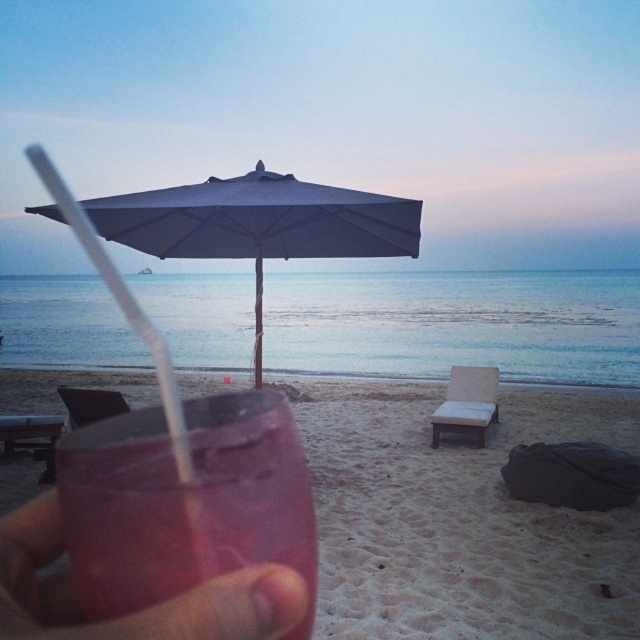
The width and height of the screenshot is (640, 640). What do you see at coordinates (259, 224) in the screenshot? I see `gray fabric umbrella at center` at bounding box center [259, 224].

From the picture: Can you confirm if gray fabric umbrella at center is taller than pink matte cup at lower left?

Indeed, gray fabric umbrella at center has a greater height compared to pink matte cup at lower left.

Identify the location of gray fabric umbrella at center. (259, 224).

Based on the photo, can you confirm if sandy beige at lower center is positioned below pink matte cup at lower left?

Yes.

Does sandy beige at lower center have a greater width compared to pink matte cup at lower left?

Correct, the width of sandy beige at lower center exceeds that of pink matte cup at lower left.

Which is behind, point (454, 545) or point (10, 612)?

The point (454, 545) is behind.

Identify the location of sandy beige at lower center. pyautogui.click(x=461, y=516).

Does gray fabric umbrella at center have a greater height compared to transparent plastic straw at lower left?

No, gray fabric umbrella at center is not taller than transparent plastic straw at lower left.

At what (x,y) coordinates should I click in order to perform the action: click on gray fabric umbrella at center. Please return your answer as a coordinate pair (x, y). Looking at the image, I should click on (259, 224).

This screenshot has height=640, width=640. Describe the element at coordinates (259, 224) in the screenshot. I see `gray fabric umbrella at center` at that location.

Find the location of a particular element. gray fabric umbrella at center is located at coordinates (259, 224).